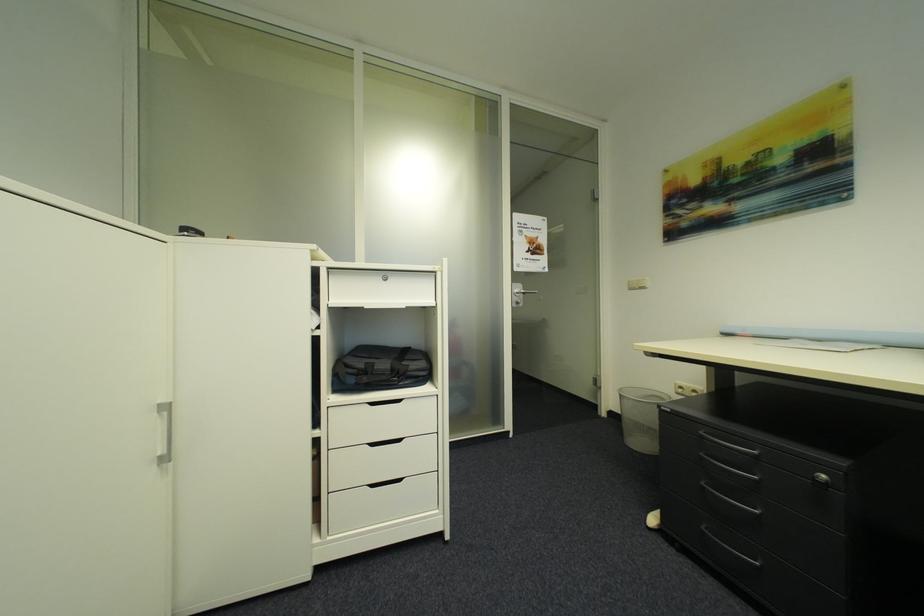
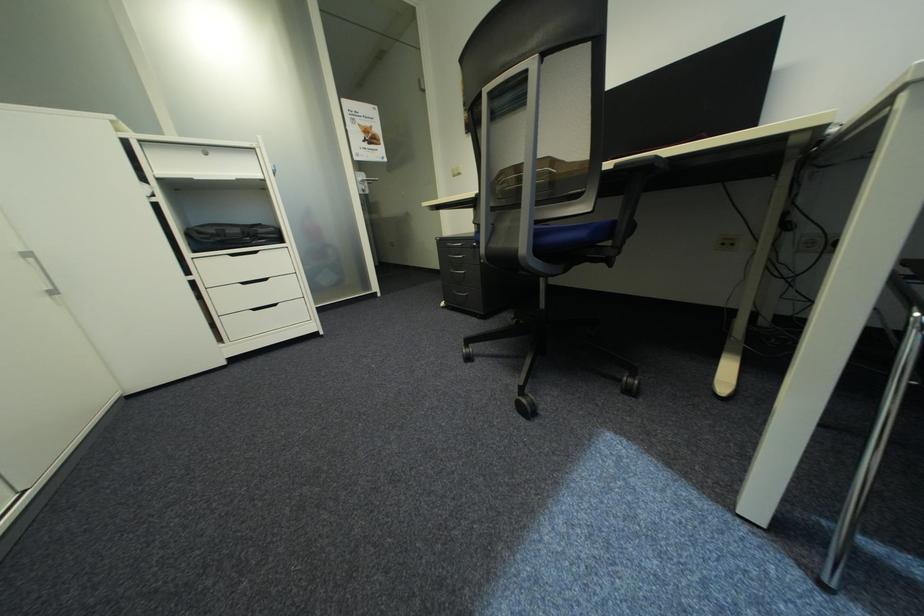
The point at (x=324, y=434) is marked in the first image. Where is the corresponding point in the second image?

(199, 278)